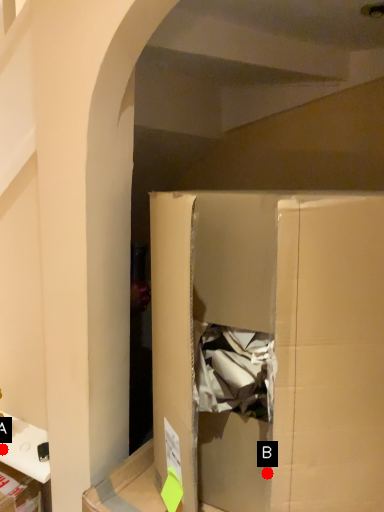
Question: Two points are circled on the image, labeled by A and B beside each circle. Which point appears closest to the camera in this image?

Choices:
 (A) A is closer
 (B) B is closer

Answer: (B)